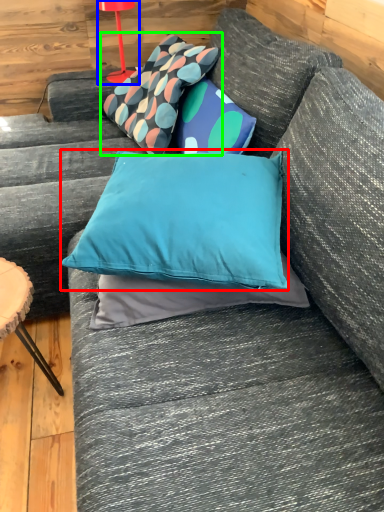
Question: Considering the real-world distances, which object is farthest from pillow (highlighted by a red box)? table lamp (highlighted by a blue box) or pillow (highlighted by a green box)?

Choices:
 (A) table lamp
 (B) pillow

Answer: (A)